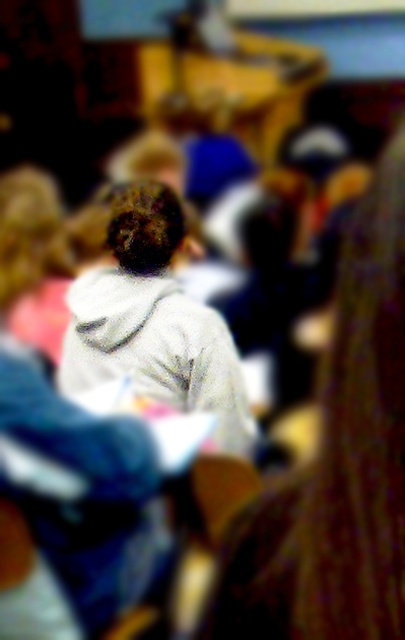
Question: Which object appears closest to the camera in this image?

Choices:
 (A) white fleece hoodie at center
 (B) white hoodie at center

Answer: (A)

Question: Considering the relative positions of white fleece hoodie at center and white hoodie at center in the image provided, where is white fleece hoodie at center located with respect to white hoodie at center?

Choices:
 (A) right
 (B) left

Answer: (A)

Question: Which of the following is the farthest from the observer?

Choices:
 (A) (390, 406)
 (B) (130, 260)

Answer: (B)

Question: Does white fleece hoodie at center appear on the right side of white hoodie at center?

Choices:
 (A) no
 (B) yes

Answer: (B)

Question: Does white fleece hoodie at center have a lesser width compared to white hoodie at center?

Choices:
 (A) no
 (B) yes

Answer: (B)

Question: Which of the following is the farthest from the observer?

Choices:
 (A) white hoodie at center
 (B) white fleece hoodie at center

Answer: (A)